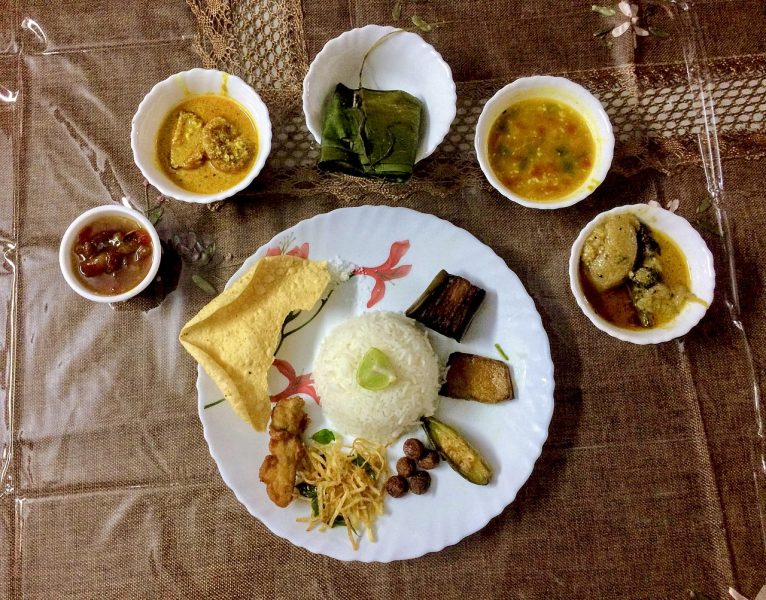
Find the location of `bowls`. bowls is located at coordinates (149, 238), (188, 196), (334, 73), (521, 89), (675, 228).